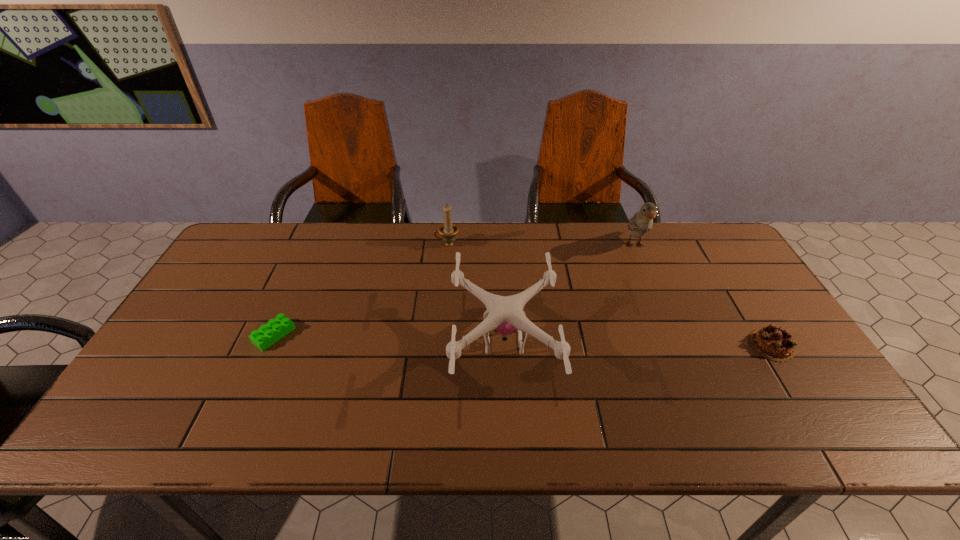
Find the location of a particular element. The image size is (960, 540). free space between the drone and the second shortest object is located at coordinates (637, 343).

Locate an element on the screen. Image resolution: width=960 pixels, height=540 pixels. free spot between the leftmost object and the drone is located at coordinates (389, 339).

Locate an element on the screen. unoccupied area between the shortest object and the candle_holder is located at coordinates (360, 289).

This screenshot has width=960, height=540. What are the coordinates of `free spot between the drone and the Lego` in the screenshot? It's located at (389, 339).

You are a GUI agent. You are given a task and a screenshot of the screen. Output one action in this format:
    pyautogui.click(x=<x>, y=<y>)
    Task: Click on the free space between the leftmost object and the candle_holder
    
    Given the screenshot: What is the action you would take?
    pyautogui.click(x=360, y=289)

Find the location of `the third closest object to the candle_holder`. the third closest object to the candle_holder is located at coordinates (642, 222).

Select which object is the fourth closest to the fourth object from left to right. Please provide its 2D coordinates. Your answer should be formatted as a tuple, i.e. [(x, y)], where the tuple contains the x and y coordinates of a point satisfying the conditions above.

[(275, 329)]

You are a GUI agent. You are given a task and a screenshot of the screen. Output one action in this format:
    pyautogui.click(x=<x>, y=<y>)
    Task: Click on the blank space that satisfies the following two spatial constraints: 1. at the face of the bird; 2. on the top of the drone
    Image resolution: width=960 pixels, height=540 pixels.
    Given the screenshot: What is the action you would take?
    click(x=675, y=342)

Identify the location of free region that satisfies the following two spatial constraints: 1. on the top of the drone; 2. on the right side of the second shortest object. The height and width of the screenshot is (540, 960). (504, 345).

You are a GUI agent. You are given a task and a screenshot of the screen. Output one action in this format:
    pyautogui.click(x=<x>, y=<y>)
    Task: Click on the blank area in the image that satisfies the following two spatial constraints: 1. at the face of the chocolate cake; 2. on the left side of the bird
    The height and width of the screenshot is (540, 960).
    Given the screenshot: What is the action you would take?
    pyautogui.click(x=677, y=345)